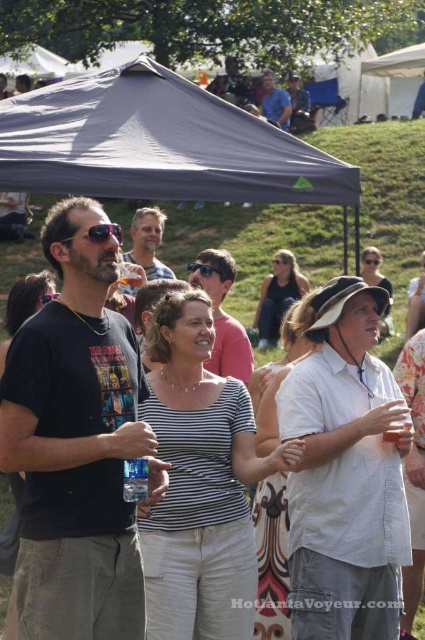
Who is more distant from viewer, (x=40, y=172) or (x=223, y=280)?

The point (x=223, y=280) is behind.

From the picture: Can you confirm if dark gray fabric canopy at upper center is positioned to the right of black plastic sunglasses at center?

Incorrect, dark gray fabric canopy at upper center is not on the right side of black plastic sunglasses at center.

Between point (311, 189) and point (218, 273), which one is positioned behind?

The point (218, 273) is behind.

At what (x,y) coordinates should I click in order to perform the action: click on dark gray fabric canopy at upper center. Please return your answer as a coordinate pair (x, y). The height and width of the screenshot is (640, 425). Looking at the image, I should click on (158, 145).

Who is shorter, dark gray fabric canopy at upper center or matte black sunglasses at center?

With less height is matte black sunglasses at center.

Is point (65, 128) positioned in front of point (73, 236)?

No, it is not.

The image size is (425, 640). I want to click on dark gray fabric canopy at upper center, so click(158, 145).

Which is above, white cotton shirt at center or dark gray fabric canopy at upper center?

dark gray fabric canopy at upper center

Is white cotton shirt at center wider than dark gray fabric canopy at upper center?

No.

Is point (300, 360) in front of point (141, 92)?

Yes, point (300, 360) is closer to viewer.

Locate an element on the screen. white cotton shirt at center is located at coordinates (345, 474).